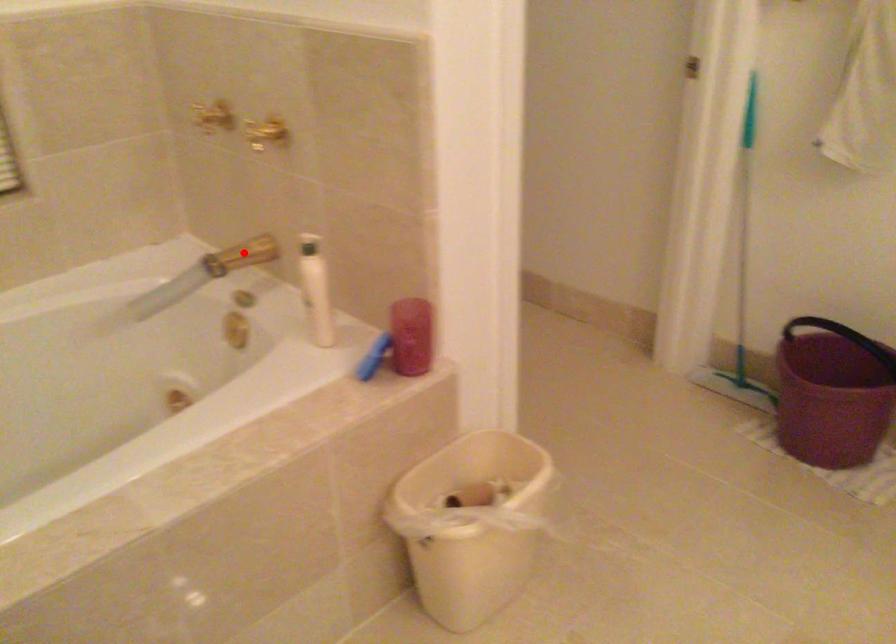
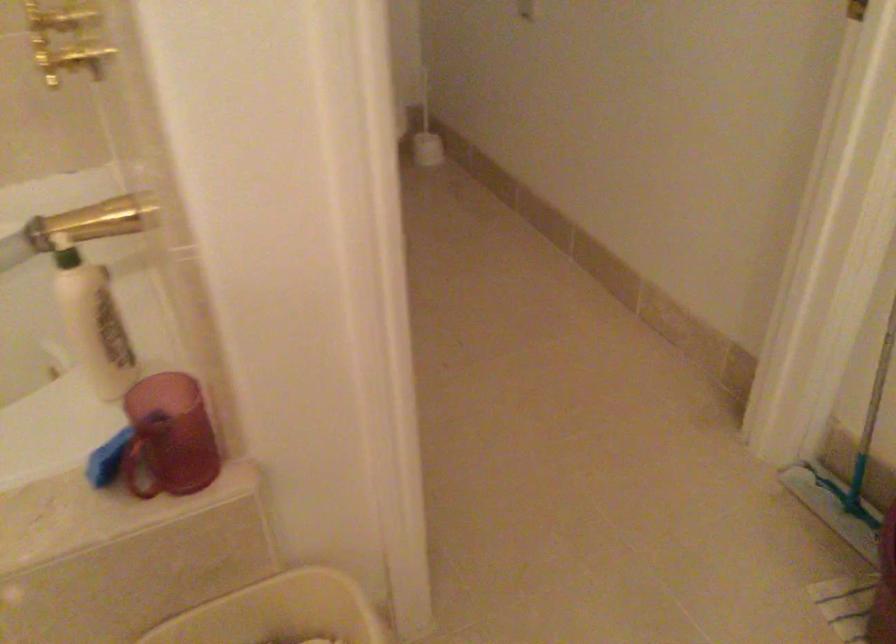
The point at the highlighted location is marked in the first image. Where is the corresponding point in the second image?

(95, 222)